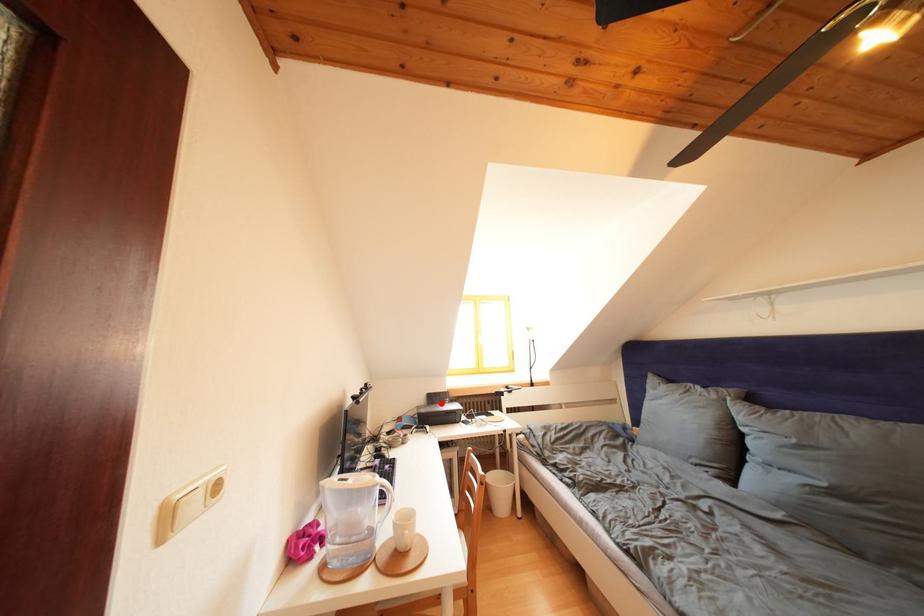
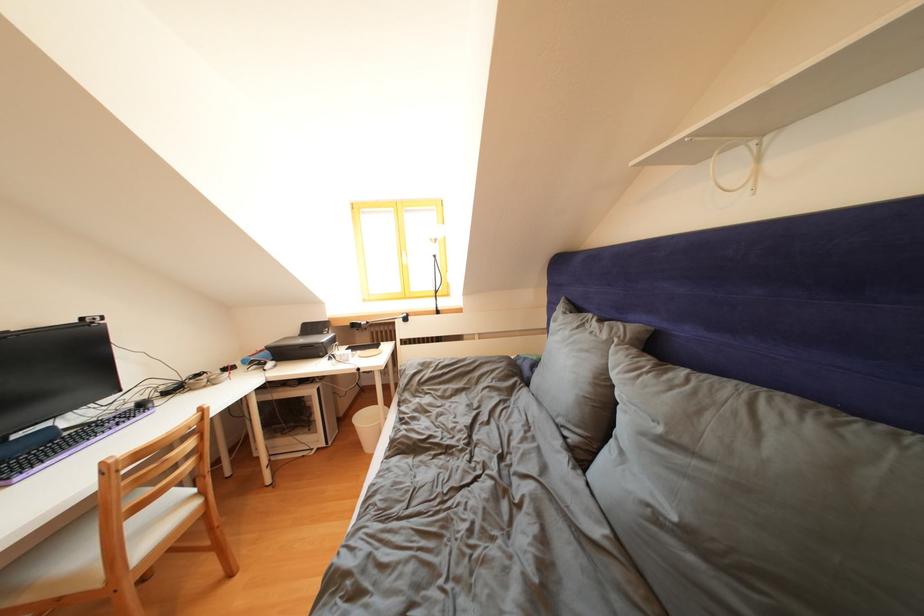
Where in the second image is the point corresponding to the highlighted location from the first image?

(319, 333)